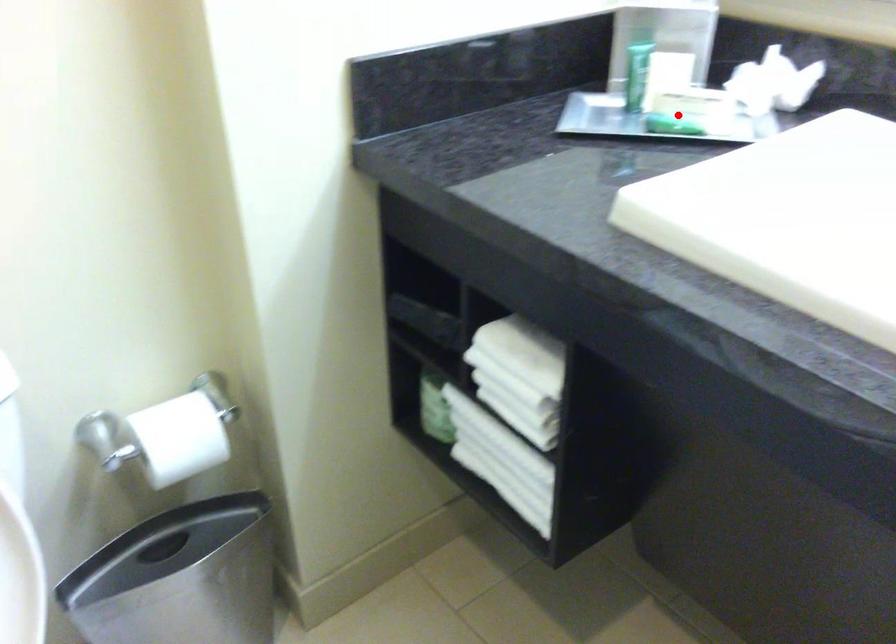
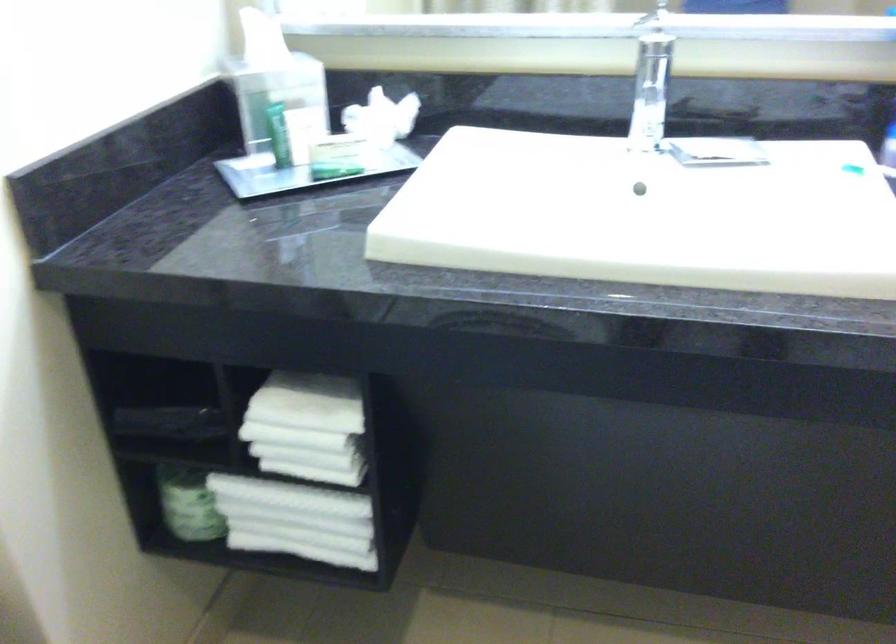
The point at the highlighted location is marked in the first image. Where is the corresponding point in the second image?

(337, 160)